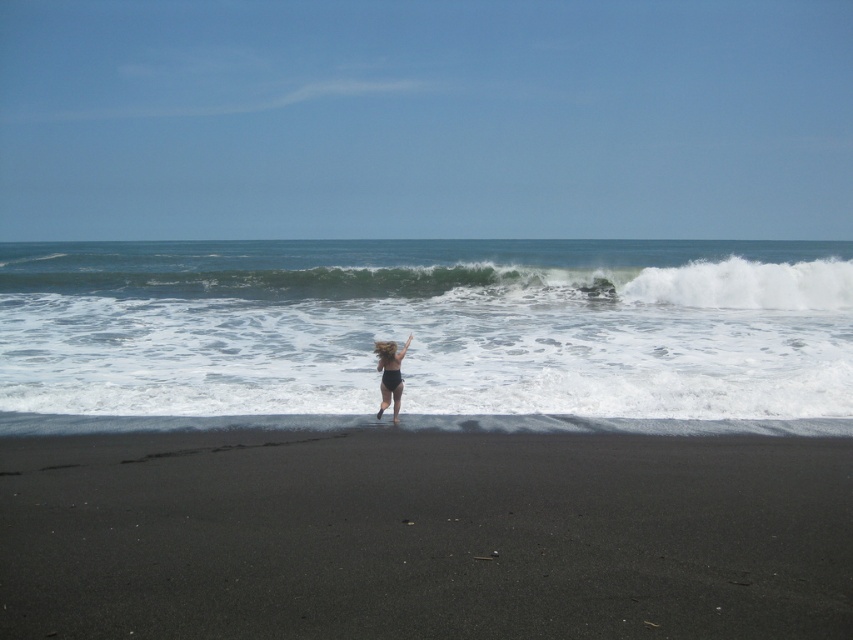
Is point (737, 627) less distant than point (404, 346)?

Yes, it is in front of point (404, 346).

Is black sand at lower center bigger than black matte swimsuit at center?

No, black sand at lower center is not bigger than black matte swimsuit at center.

Who is more distant from viewer, (260, 506) or (386, 372)?

Point (386, 372)

You are a GUI agent. You are given a task and a screenshot of the screen. Output one action in this format:
    pyautogui.click(x=<x>, y=<y>)
    Task: Click on the black sand at lower center
    The height and width of the screenshot is (640, 853).
    Given the screenshot: What is the action you would take?
    pyautogui.click(x=424, y=534)

Can you confirm if white frothy wave at center is thinner than black matte swimsuit at center?

In fact, white frothy wave at center might be wider than black matte swimsuit at center.

Locate an element on the screen. white frothy wave at center is located at coordinates (428, 326).

Locate an element on the screen. white frothy wave at center is located at coordinates (428, 326).

At what (x,y) coordinates should I click in order to perform the action: click on white frothy wave at center. Please return your answer as a coordinate pair (x, y). Looking at the image, I should click on tap(428, 326).

In the scene shown: Is black sand at lower center to the left of white frothy wave at upper center from the viewer's perspective?

Indeed, black sand at lower center is positioned on the left side of white frothy wave at upper center.

This screenshot has height=640, width=853. What do you see at coordinates (424, 534) in the screenshot?
I see `black sand at lower center` at bounding box center [424, 534].

Locate an element on the screen. This screenshot has height=640, width=853. black sand at lower center is located at coordinates (424, 534).